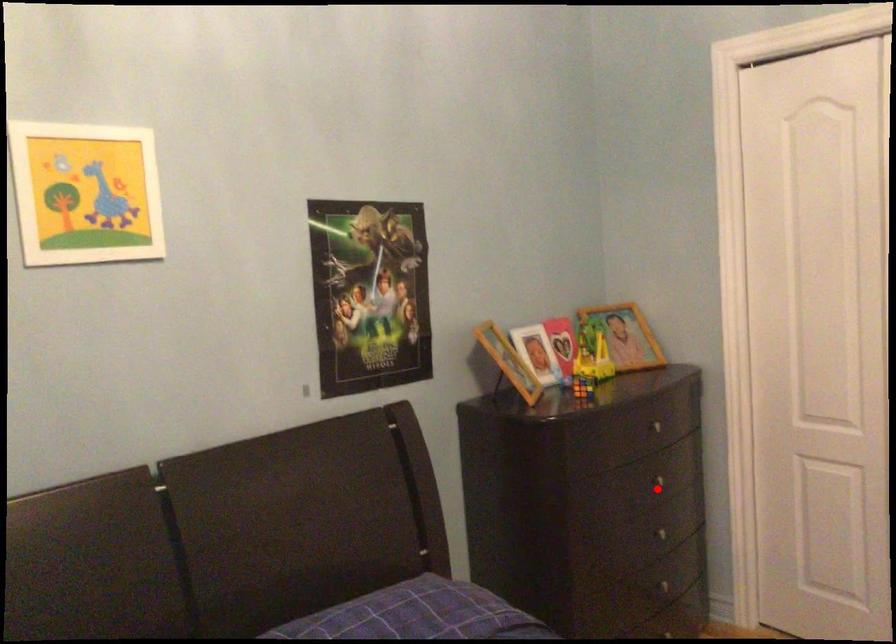
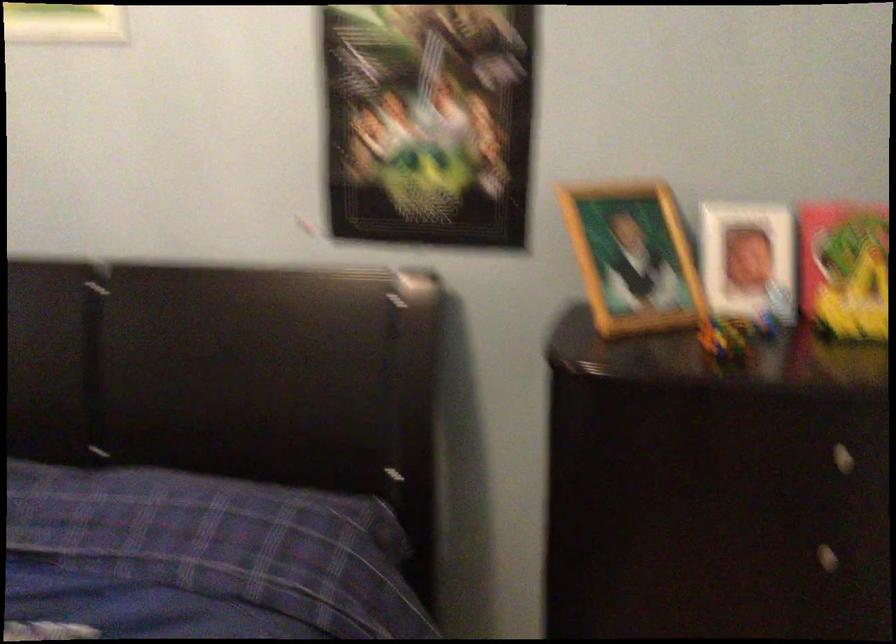
Locate, in the second image, the point that corresponds to the highlighted location in the first image.

(807, 554)